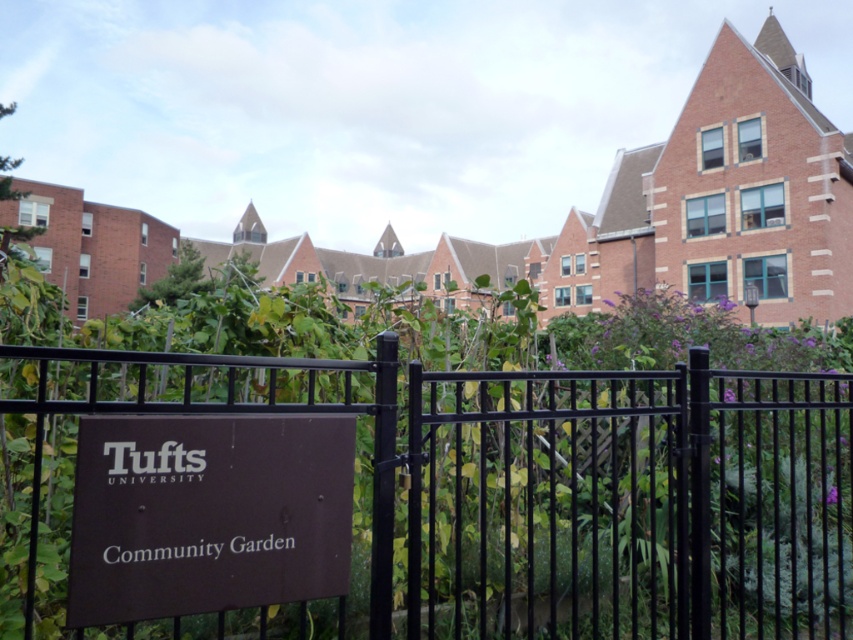
You are standing in front of the Tufts University Community Garden. You see the black metal fence at center and the brown matte sign at lower center. Which object is closer to you?

The black metal fence at center is closer to the viewer than the brown matte sign at lower center.

You are a visitor at Tufts University and want to see the community garden sign. You notice the black metal fence at center and the brown matte sign at lower center. Which object is taller?

The black metal fence at center is taller than the brown matte sign at lower center according to the description.

You are a visitor at Tufts University and want to locate the community garden. You see the black metal fence at center and the brown matte sign at lower center. According to the scene, which object should you look for first to confirm your location?

The brown matte sign at lower center should be looked for first since it is positioned at the lower center, closer to the foreground, and indicates the garden area with its text. The black metal fence at center is to the right of the sign, so locating the sign first would confirm you are at the community garden.